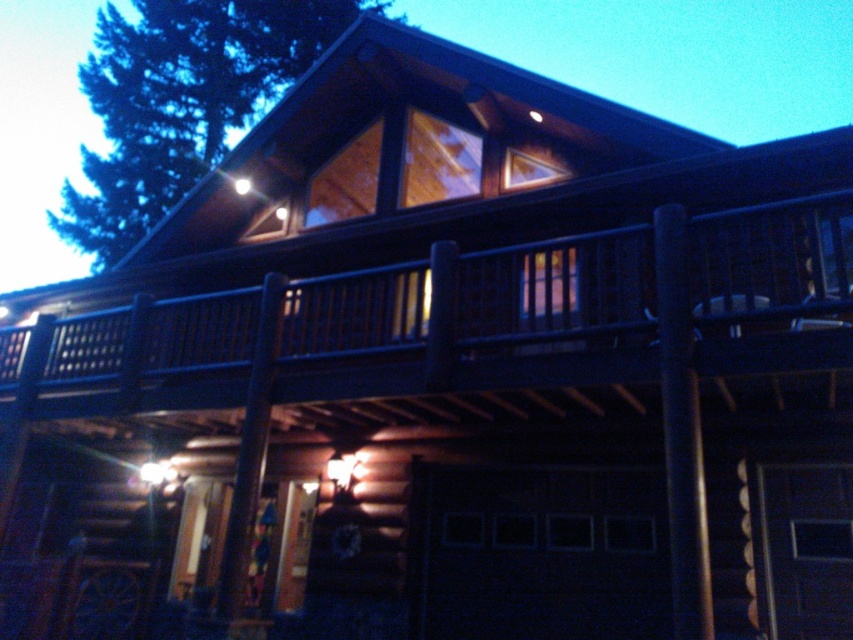
Between dark wood porch at upper center and green leafy tree at upper left, which one is positioned higher?

green leafy tree at upper left

Can you confirm if dark wood porch at upper center is positioned above green leafy tree at upper left?

Incorrect, dark wood porch at upper center is not positioned above green leafy tree at upper left.

Is point (454, 323) positioned behind point (250, 90)?

No.

Identify the location of dark wood porch at upper center. Image resolution: width=853 pixels, height=640 pixels. (467, 317).